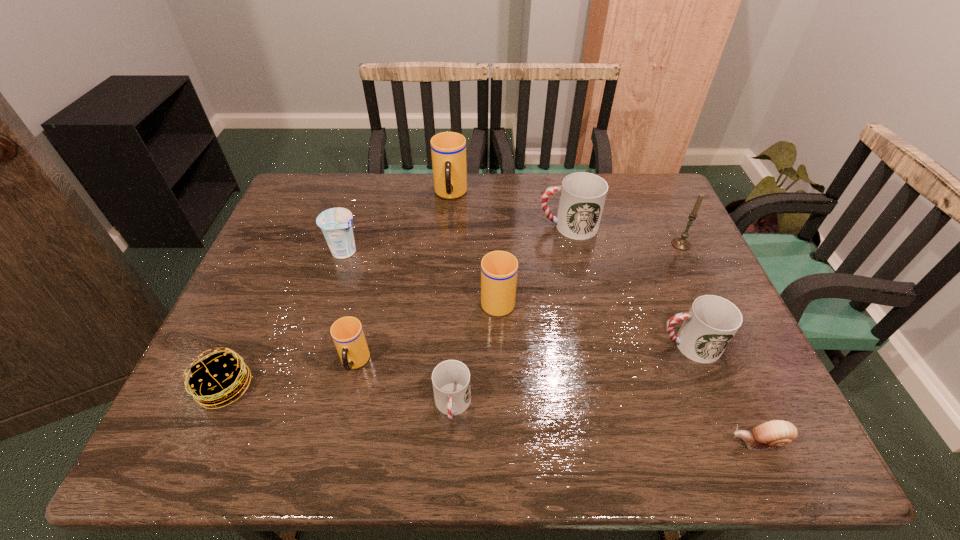
Locate an element on the screen. vacant space located on the side of the nearest beige cup with the handle is located at coordinates (342, 420).

Identify the location of vacant area situated 0.080m on the right of the patty. The height and width of the screenshot is (540, 960). (290, 387).

This screenshot has height=540, width=960. In order to click on blank area located 0.050m on the side of the nearest cup where the handle is located in this screenshot , I will do `click(450, 456)`.

This screenshot has width=960, height=540. I want to click on free spot located 0.070m on the front-facing side of the shortest object, so click(691, 442).

The height and width of the screenshot is (540, 960). Identify the location of free spot located 0.180m on the front-facing side of the shortest object. (636, 442).

Locate an element on the screen. vacant space located on the front-facing side of the shortest object is located at coordinates 645,442.

I want to click on cup present at the near edge, so click(451, 379).

Image resolution: width=960 pixels, height=540 pixels. Identify the location of escargot located in the near edge section of the desktop. (776, 433).

Where is `object present at the left edge`? Image resolution: width=960 pixels, height=540 pixels. object present at the left edge is located at coordinates 219,378.

You are a GUI agent. You are given a task and a screenshot of the screen. Output one action in this format:
    pyautogui.click(x=<x>, y=<y>)
    Task: Click on the candle located at the right edge
    
    Given the screenshot: What is the action you would take?
    pyautogui.click(x=681, y=243)